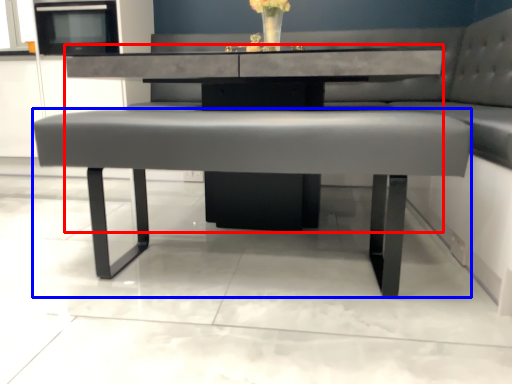
Question: Among these objects, which one is nearest to the camera, round table (highlighted by a red box) or coffee table (highlighted by a blue box)?

Choices:
 (A) round table
 (B) coffee table

Answer: (B)